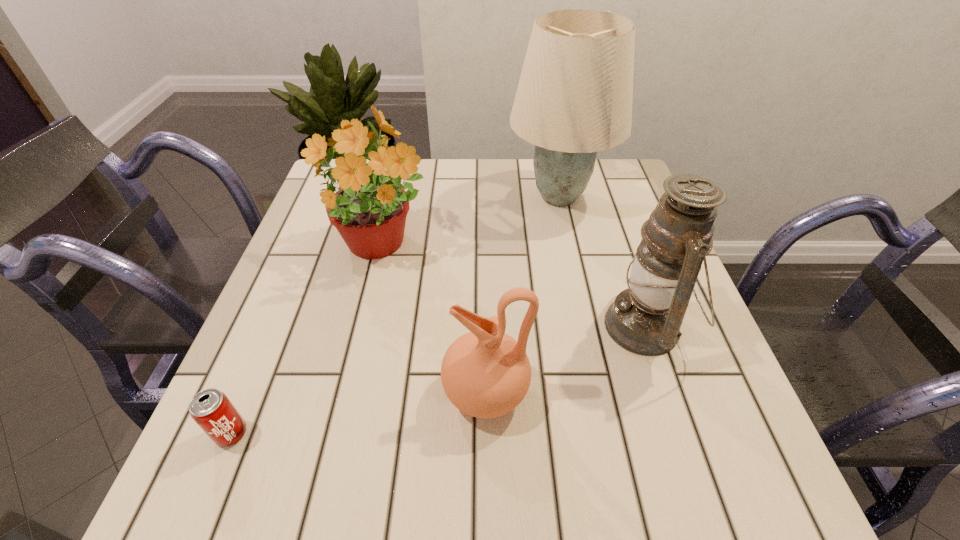
Locate an element on the screen. the second closest object to the fourth object from right to left is located at coordinates (485, 373).

I want to click on free region that satisfies the following two spatial constraints: 1. on the back side of the beer can; 2. on the right side of the flowerpot, so click(309, 247).